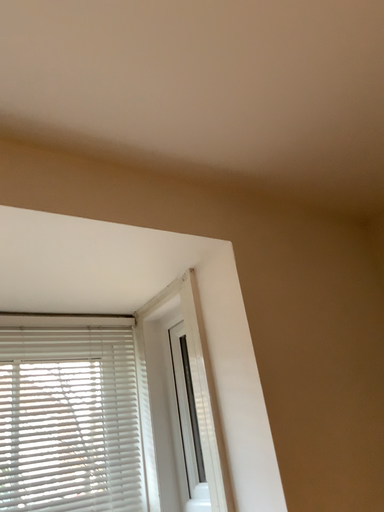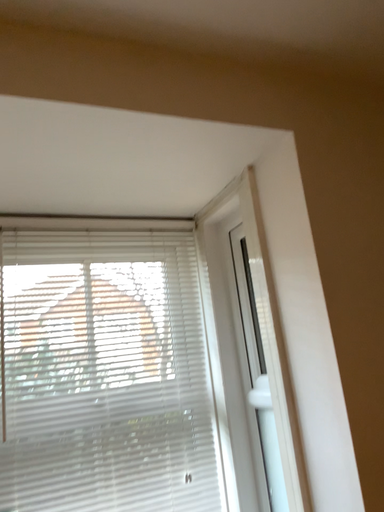
Question: Which way did the camera rotate in the video?

Choices:
 (A) rotated upward
 (B) rotated downward

Answer: (B)